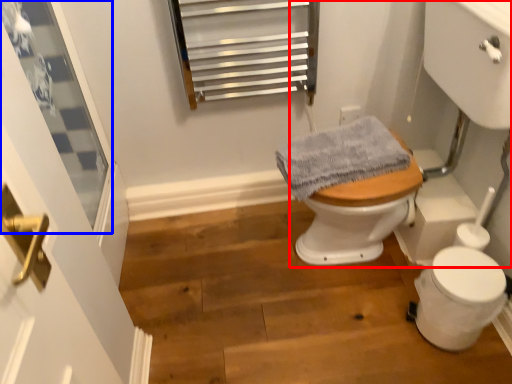
Question: Among these objects, which one is farthest to the camera, sink (highlighted by a red box) or window (highlighted by a blue box)?

Choices:
 (A) sink
 (B) window

Answer: (B)